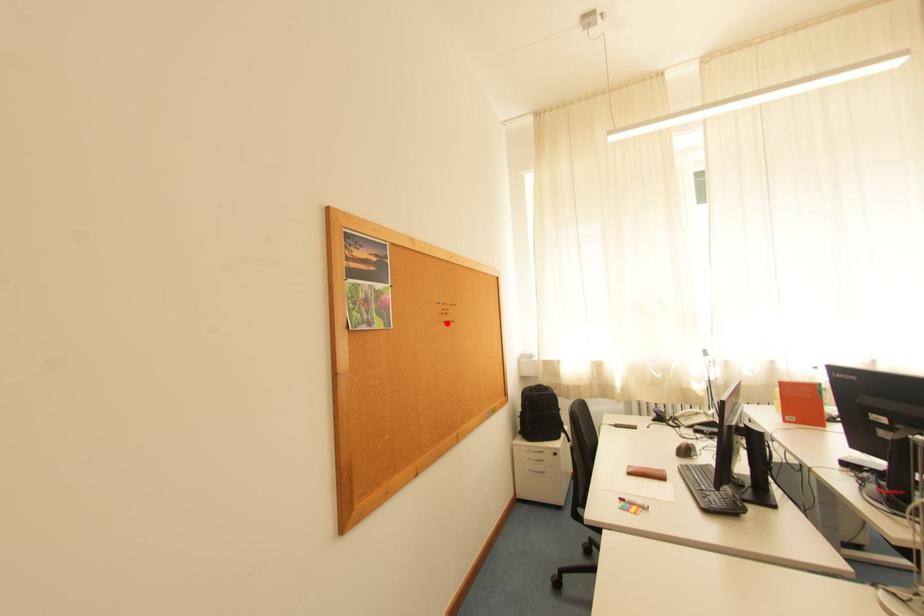
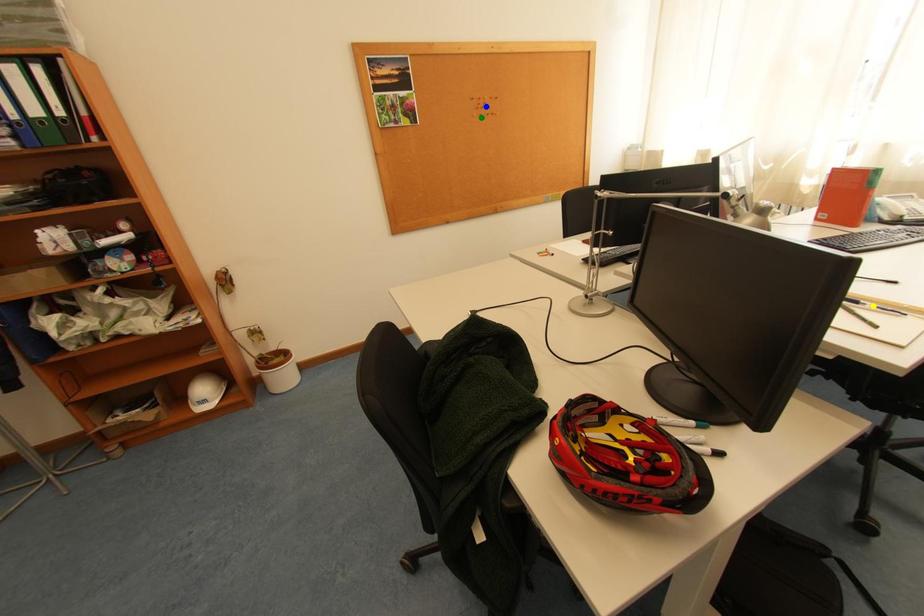
Question: I am providing you with two images of the same scene from different viewpoints. A red point is marked on the first image. You are given multiple points on the second image. Which spot in image 2 lines up with the point in image 1?

Choices:
 (A) blue point
 (B) yellow point
 (C) green point

Answer: (C)